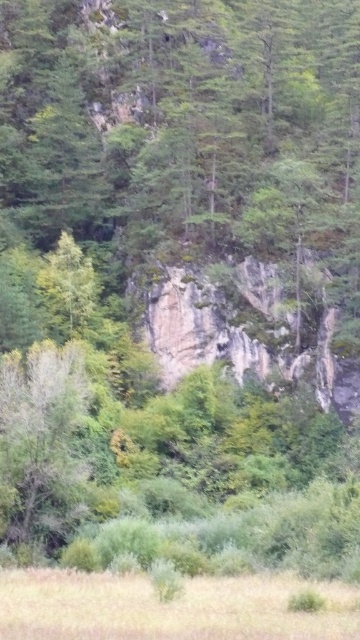
Can you confirm if rough stone cliff at center is positioned above green matte tree at lower left?

Correct, rough stone cliff at center is located above green matte tree at lower left.

Is rough stone cliff at center smaller than green matte tree at lower left?

No, rough stone cliff at center is not smaller than green matte tree at lower left.

I want to click on rough stone cliff at center, so click(x=241, y=332).

Measure the distance between dry grass at lower center and camera.

dry grass at lower center is 25.25 meters from camera.

Find the location of `dry grass at lower center`. dry grass at lower center is located at coordinates click(168, 608).

Does dry grass at lower center have a larger size compared to green matte tree at lower left?

Correct, dry grass at lower center is larger in size than green matte tree at lower left.

Does dry grass at lower center appear over green matte tree at lower left?

No.

Locate an element on the screen. This screenshot has width=360, height=640. dry grass at lower center is located at coordinates (168, 608).